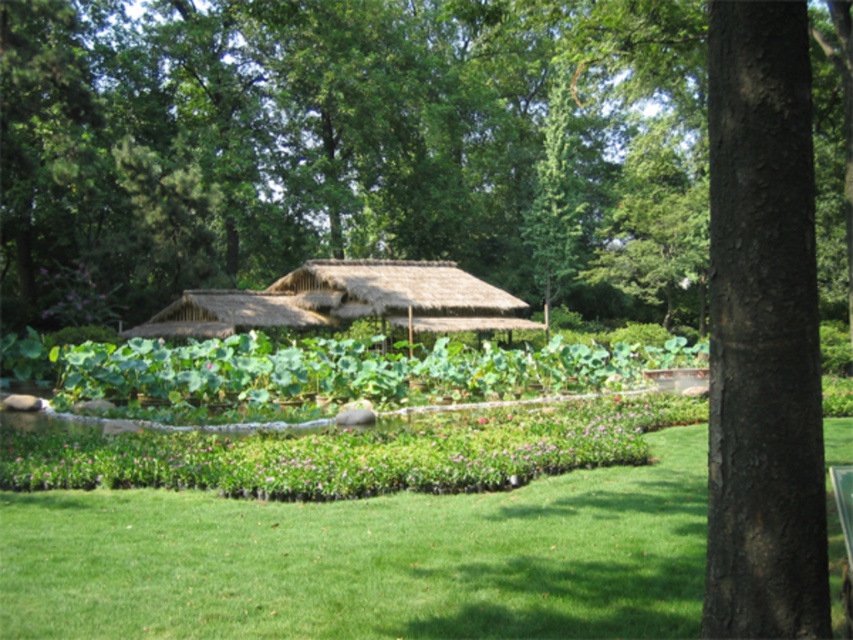
Does dark brown textured tree trunk at center right appear under thatched straw hut at center?

Indeed, dark brown textured tree trunk at center right is positioned under thatched straw hut at center.

Can you confirm if dark brown textured tree trunk at center right is wider than thatched straw hut at center?

No.

Locate an element on the screen. The image size is (853, 640). dark brown textured tree trunk at center right is located at coordinates (762, 332).

The width and height of the screenshot is (853, 640). In order to click on dark brown textured tree trunk at center right in this screenshot , I will do `click(762, 332)`.

Does green grass at lower center appear on the right side of thatched straw hut at center?

Indeed, green grass at lower center is positioned on the right side of thatched straw hut at center.

How much distance is there between green grass at lower center and thatched straw hut at center?

They are 77.21 feet apart.

Between point (660, 605) and point (515, 310), which one is positioned behind?

Positioned behind is point (515, 310).

Where is `green grass at lower center`? The image size is (853, 640). green grass at lower center is located at coordinates (368, 560).

Between green grass at lower center and dark brown textured tree trunk at center right, which one is positioned lower?

Positioned lower is green grass at lower center.

Who is more forward, (10, 552) or (764, 566)?

Point (764, 566) is in front.

This screenshot has height=640, width=853. In order to click on green grass at lower center in this screenshot , I will do `click(368, 560)`.